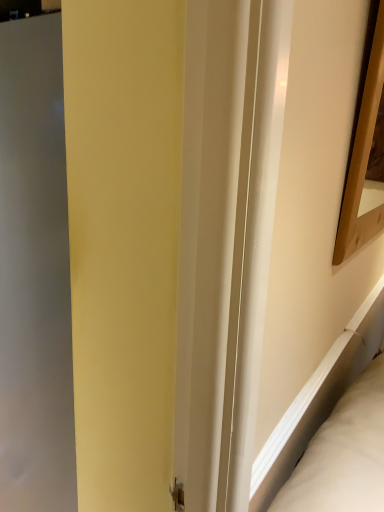
Question: Does wooden picture frame at upper right appear on the right side of matte gray screen door at left?

Choices:
 (A) yes
 (B) no

Answer: (A)

Question: Can you confirm if wooden picture frame at upper right is bigger than matte gray screen door at left?

Choices:
 (A) no
 (B) yes

Answer: (A)

Question: Is wooden picture frame at upper right smaller than matte gray screen door at left?

Choices:
 (A) yes
 (B) no

Answer: (A)

Question: Are wooden picture frame at upper right and matte gray screen door at left making contact?

Choices:
 (A) no
 (B) yes

Answer: (A)

Question: From the image's perspective, is wooden picture frame at upper right located above matte gray screen door at left?

Choices:
 (A) no
 (B) yes

Answer: (B)

Question: Is wooden picture frame at upper right located outside matte gray screen door at left?

Choices:
 (A) no
 (B) yes

Answer: (B)

Question: Can you confirm if matte gray screen door at left is positioned to the right of wooden picture frame at upper right?

Choices:
 (A) yes
 (B) no

Answer: (B)

Question: Is wooden picture frame at upper right a part of matte gray screen door at left?

Choices:
 (A) no
 (B) yes

Answer: (A)

Question: Does matte gray screen door at left have a larger size compared to wooden picture frame at upper right?

Choices:
 (A) no
 (B) yes

Answer: (B)

Question: Is matte gray screen door at left oriented towards wooden picture frame at upper right?

Choices:
 (A) no
 (B) yes

Answer: (A)

Question: Does matte gray screen door at left have a lesser height compared to wooden picture frame at upper right?

Choices:
 (A) yes
 (B) no

Answer: (B)

Question: From a real-world perspective, is matte gray screen door at left under wooden picture frame at upper right?

Choices:
 (A) yes
 (B) no

Answer: (A)

Question: Would you say wooden picture frame at upper right is to the left or to the right of matte gray screen door at left in the picture?

Choices:
 (A) right
 (B) left

Answer: (A)